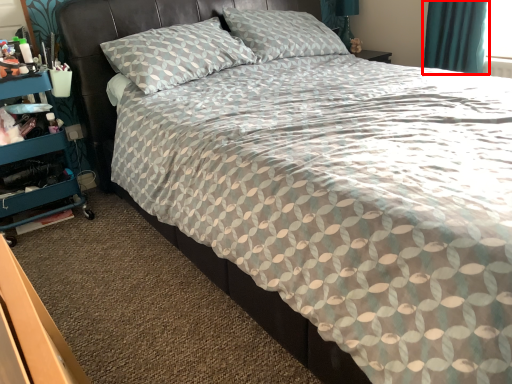
Question: Observing the image, what is the correct spatial positioning of curtain (annotated by the red box) in reference to dresser?

Choices:
 (A) right
 (B) left

Answer: (A)